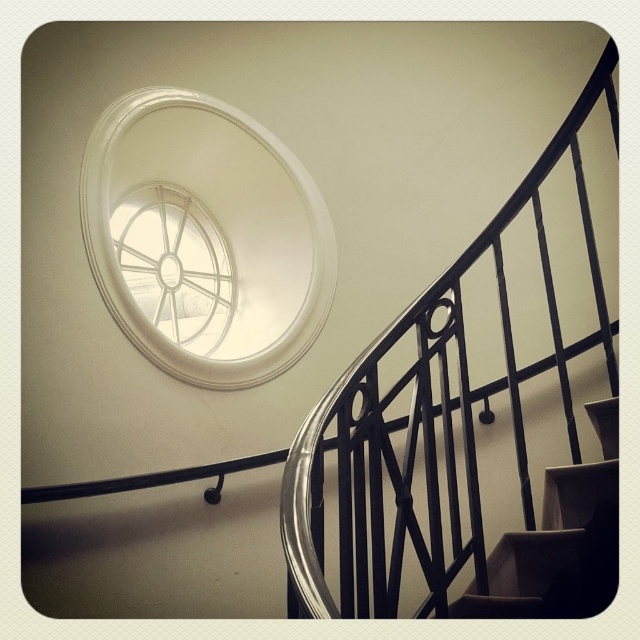
You are standing at the base of the spiral staircase and want to walk towards the point marked as point (433, 592). There is an obstacle at point (144, 116). Will you encounter this obstacle before reaching your destination?

Point (144, 116) is behind point (433, 592), so you will not encounter the obstacle at point (144, 116) before reaching your destination.

You are an interior designer planning to install a new light fixture between the black metal railing at upper right and the white glass spiral at upper center. The light fixture requires a minimum of 2 meters of space between the two objects to be safely installed. Can you confirm if there is enough space for the installation?

The black metal railing at upper right is 2.55 meters from the white glass spiral at upper center, which is more than the required 2 meters. Therefore, there is sufficient space to install the light fixture between them.